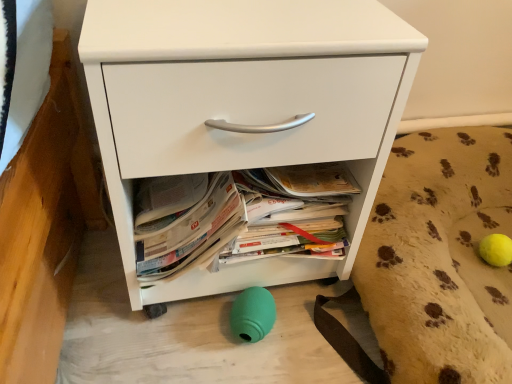
Where is `white matte chest of drawers at center`? white matte chest of drawers at center is located at coordinates (244, 106).

Measure the distance between white matte chest of drawers at center and camera.

white matte chest of drawers at center and camera are 16.57 inches apart from each other.

The width and height of the screenshot is (512, 384). What do you see at coordinates (244, 106) in the screenshot? I see `white matte chest of drawers at center` at bounding box center [244, 106].

In order to face beige textured dog bed at lower right, should I rotate leftwards or rightwards?

Rotate right and turn 28.622 degrees.

I want to click on beige textured dog bed at lower right, so click(x=434, y=263).

This screenshot has height=384, width=512. What do you see at coordinates (434, 263) in the screenshot? I see `beige textured dog bed at lower right` at bounding box center [434, 263].

At what (x,y) coordinates should I click in order to perform the action: click on white matte chest of drawers at center. Please return your answer as a coordinate pair (x, y). Looking at the image, I should click on (244, 106).

Considering the relative positions of white matte chest of drawers at center and beige textured dog bed at lower right in the image provided, is white matte chest of drawers at center to the right of beige textured dog bed at lower right from the viewer's perspective?

No, white matte chest of drawers at center is not to the right of beige textured dog bed at lower right.

Considering the positions of objects white matte chest of drawers at center and beige textured dog bed at lower right in the image provided, who is in front, white matte chest of drawers at center or beige textured dog bed at lower right?

white matte chest of drawers at center.

Which is closer to the camera, (331,38) or (397,338)?

Point (331,38) appears to be closer to the viewer than point (397,338).

From the image's perspective, relative to beige textured dog bed at lower right, is white matte chest of drawers at center above or below?

white matte chest of drawers at center is situated higher than beige textured dog bed at lower right in the image.

From a real-world perspective, which is physically above, white matte chest of drawers at center or beige textured dog bed at lower right?

In real-world perspective, white matte chest of drawers at center is above.

Between white matte chest of drawers at center and beige textured dog bed at lower right, which one has smaller width?

white matte chest of drawers at center is thinner.

Can you confirm if white matte chest of drawers at center is taller than beige textured dog bed at lower right?

Correct, white matte chest of drawers at center is much taller as beige textured dog bed at lower right.

Based on their sizes in the image, would you say white matte chest of drawers at center is bigger or smaller than beige textured dog bed at lower right?

In the image, white matte chest of drawers at center appears to be larger than beige textured dog bed at lower right.

Is white matte chest of drawers at center positioned beyond the bounds of beige textured dog bed at lower right?

Yes, white matte chest of drawers at center is not within beige textured dog bed at lower right.

Is white matte chest of drawers at center directly adjacent to beige textured dog bed at lower right?

No, white matte chest of drawers at center is not making contact with beige textured dog bed at lower right.

Is white matte chest of drawers at center positioned with its back to beige textured dog bed at lower right?

No, beige textured dog bed at lower right is not at the back of white matte chest of drawers at center.

What's the angular difference between white matte chest of drawers at center and beige textured dog bed at lower right's facing directions?

The angle between the facing direction of white matte chest of drawers at center and the facing direction of beige textured dog bed at lower right is 0.696 degrees.

Locate an element on the screen. The height and width of the screenshot is (384, 512). chest of drawers above the beige textured dog bed at lower right (from a real-world perspective) is located at coordinates (244, 106).

Consider the image. Considering the positions of objects beige textured dog bed at lower right and white matte chest of drawers at center in the image provided, who is more to the right, beige textured dog bed at lower right or white matte chest of drawers at center?

From the viewer's perspective, beige textured dog bed at lower right appears more on the right side.

Is the depth of beige textured dog bed at lower right less than that of white matte chest of drawers at center?

No, beige textured dog bed at lower right is behind white matte chest of drawers at center.

Is point (362, 365) closer or farther from the camera than point (346, 92)?

Point (362, 365) is positioned farther from the camera compared to point (346, 92).

From the image's perspective, is beige textured dog bed at lower right beneath white matte chest of drawers at center?

Yes.

From a real-world perspective, does beige textured dog bed at lower right sit lower than white matte chest of drawers at center?

Yes.

Based on the photo, between beige textured dog bed at lower right and white matte chest of drawers at center, which one has larger width?

beige textured dog bed at lower right is wider.

From their relative heights in the image, would you say beige textured dog bed at lower right is taller or shorter than white matte chest of drawers at center?

In the image, beige textured dog bed at lower right appears to be shorter than white matte chest of drawers at center.

Looking at the image, does beige textured dog bed at lower right seem bigger or smaller compared to white matte chest of drawers at center?

In the image, beige textured dog bed at lower right appears to be smaller than white matte chest of drawers at center.

In the scene shown: Is beige textured dog bed at lower right positioned beyond the bounds of white matte chest of drawers at center?

Indeed, beige textured dog bed at lower right is completely outside white matte chest of drawers at center.

Are beige textured dog bed at lower right and white matte chest of drawers at center far apart?

beige textured dog bed at lower right is actually quite close to white matte chest of drawers at center.

Is white matte chest of drawers at center at the back of beige textured dog bed at lower right?

No, beige textured dog bed at lower right's orientation is not away from white matte chest of drawers at center.

In order to click on dog bed that appears below the white matte chest of drawers at center (from a real-world perspective) in this screenshot , I will do `click(434, 263)`.

At what (x,y) coordinates should I click in order to perform the action: click on dog bed that is under the white matte chest of drawers at center (from a real-world perspective). Please return your answer as a coordinate pair (x, y). Looking at the image, I should click on (434, 263).

The width and height of the screenshot is (512, 384). Identify the location of chest of drawers on the left of beige textured dog bed at lower right. (244, 106).